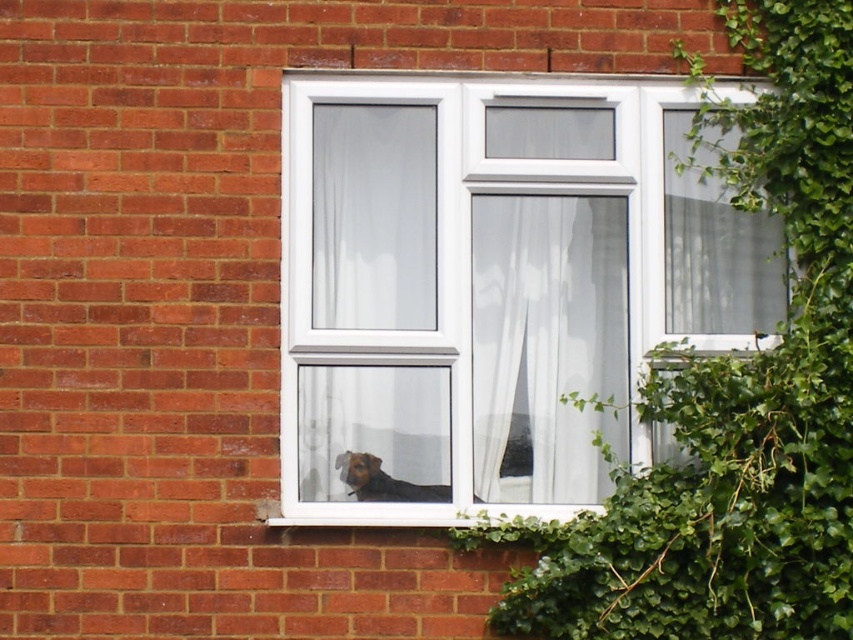
Based on the photo, between white sheer curtain at center and white plastic window sill at lower center, which one is positioned lower?

white plastic window sill at lower center

Can you confirm if white sheer curtain at center is positioned to the left of white plastic window sill at lower center?

No, white sheer curtain at center is not to the left of white plastic window sill at lower center.

This screenshot has height=640, width=853. What do you see at coordinates (546, 342) in the screenshot? I see `white sheer curtain at center` at bounding box center [546, 342].

What are the coordinates of `white sheer curtain at center` in the screenshot? It's located at (546, 342).

Is white sheer curtain at center further to the viewer compared to brown fur dog at lower center?

Yes, white sheer curtain at center is behind brown fur dog at lower center.

Between point (592, 244) and point (378, 468), which one is positioned behind?

Positioned behind is point (592, 244).

Where is `white sheer curtain at center`? The image size is (853, 640). white sheer curtain at center is located at coordinates (546, 342).

Can you confirm if white plastic window sill at lower center is shorter than brown fur dog at lower center?

Indeed, white plastic window sill at lower center has a lesser height compared to brown fur dog at lower center.

Is white plastic window sill at lower center bigger than brown fur dog at lower center?

Indeed, white plastic window sill at lower center has a larger size compared to brown fur dog at lower center.

Does point (479, 508) come closer to viewer compared to point (416, 500)?

Yes, it is in front of point (416, 500).

Locate an element on the screen. white plastic window sill at lower center is located at coordinates (434, 515).